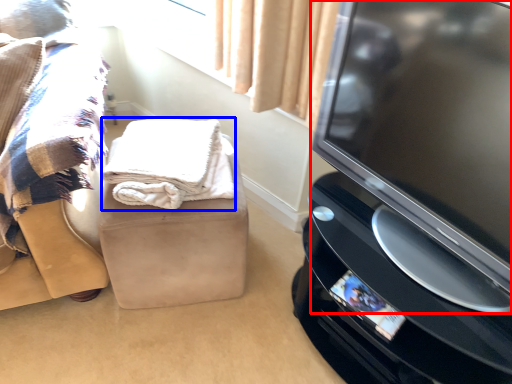
Question: Among these objects, which one is farthest to the camera, television (highlighted by a red box) or blanket (highlighted by a blue box)?

Choices:
 (A) television
 (B) blanket

Answer: (B)